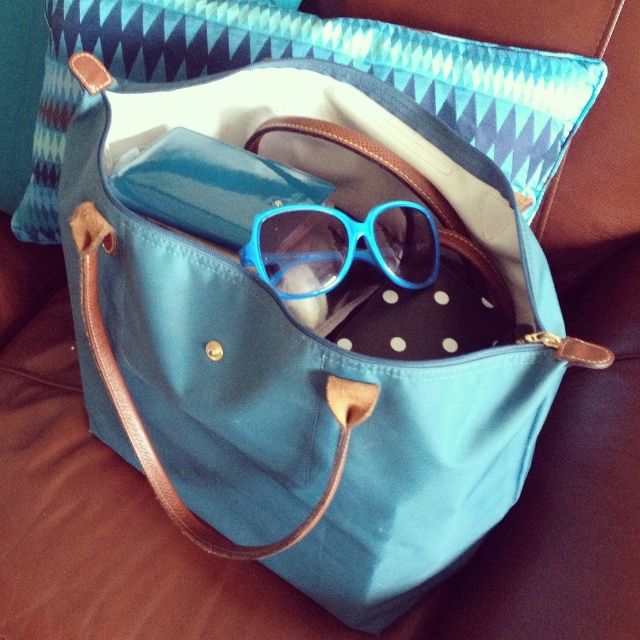
Question: Does teal zigzag fabric pillow at upper center lie behind blue matte sunglasses at center?

Choices:
 (A) no
 (B) yes

Answer: (B)

Question: Which object is farther from the camera taking this photo?

Choices:
 (A) blue matte sunglasses at center
 (B) teal zigzag fabric pillow at upper center

Answer: (B)

Question: Is teal zigzag fabric pillow at upper center above blue matte sunglasses at center?

Choices:
 (A) yes
 (B) no

Answer: (A)

Question: Where is teal zigzag fabric pillow at upper center located in relation to blue matte sunglasses at center in the image?

Choices:
 (A) below
 (B) above

Answer: (B)

Question: Which object is closer to the camera taking this photo?

Choices:
 (A) teal zigzag fabric pillow at upper center
 (B) blue matte sunglasses at center

Answer: (B)